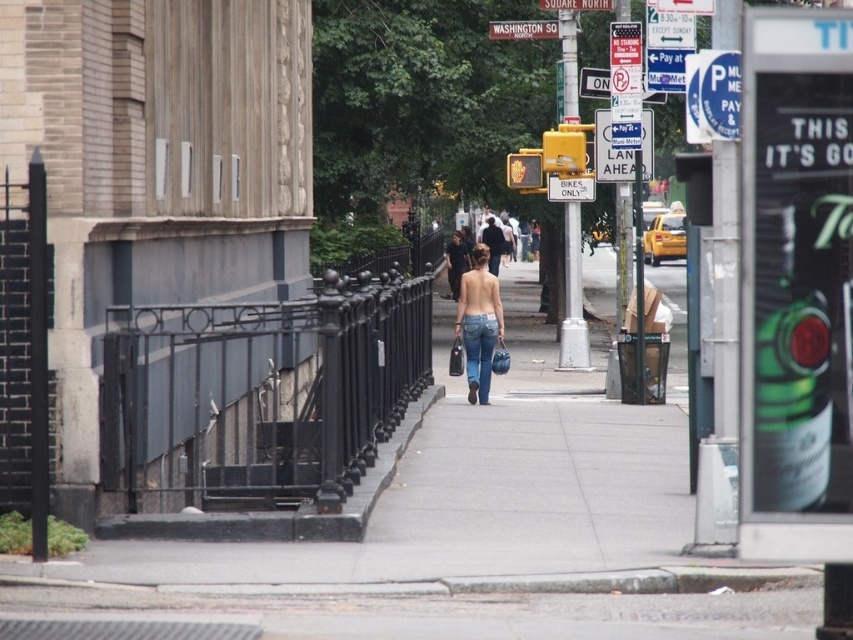
You are a photographer standing on the sidewalk. You want to take a photo of the red wooden sign at upper center while also capturing the blue denim jeans at center in the frame. Based on their positions, which object should you focus on first to ensure both are in the shot?

You should focus on the red wooden sign at upper center first because the blue denim jeans at center is to the left of it, so adjusting the frame to include the sign will naturally include the jeans as well.